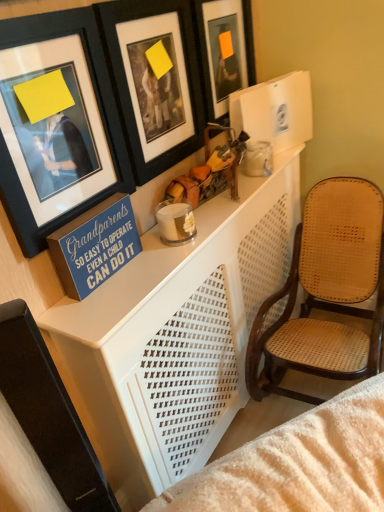
At what (x,y) coordinates should I click in order to perform the action: click on free space in front of blue painted wood sign at upper left. Please return your answer as a coordinate pair (x, y). Looking at the image, I should click on click(100, 306).